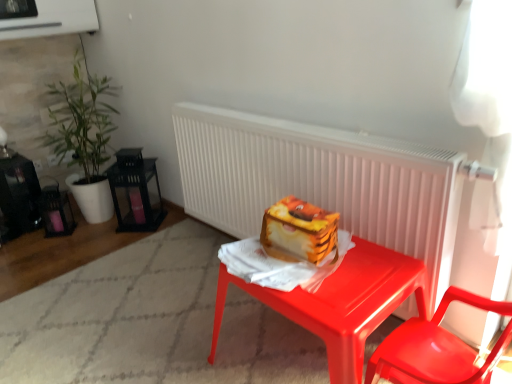
Identify the location of free space in front of green leafy plant at left. The image size is (512, 384). (79, 249).